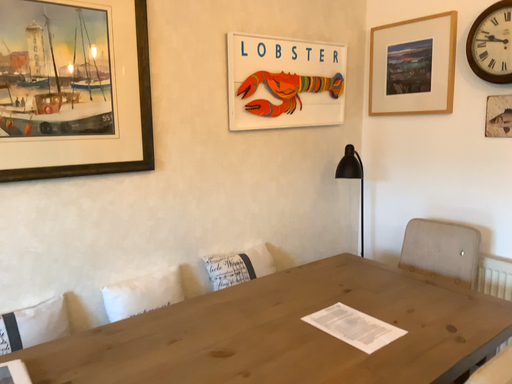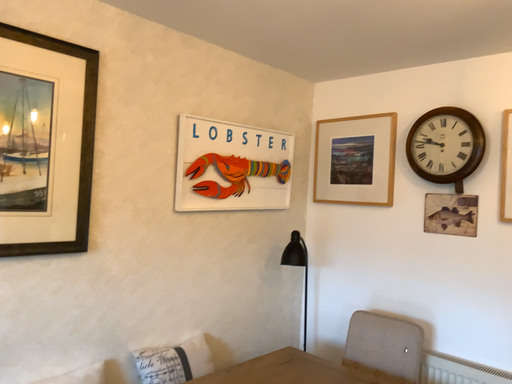
Question: Which way did the camera rotate in the video?

Choices:
 (A) rotated upward
 (B) rotated downward

Answer: (A)